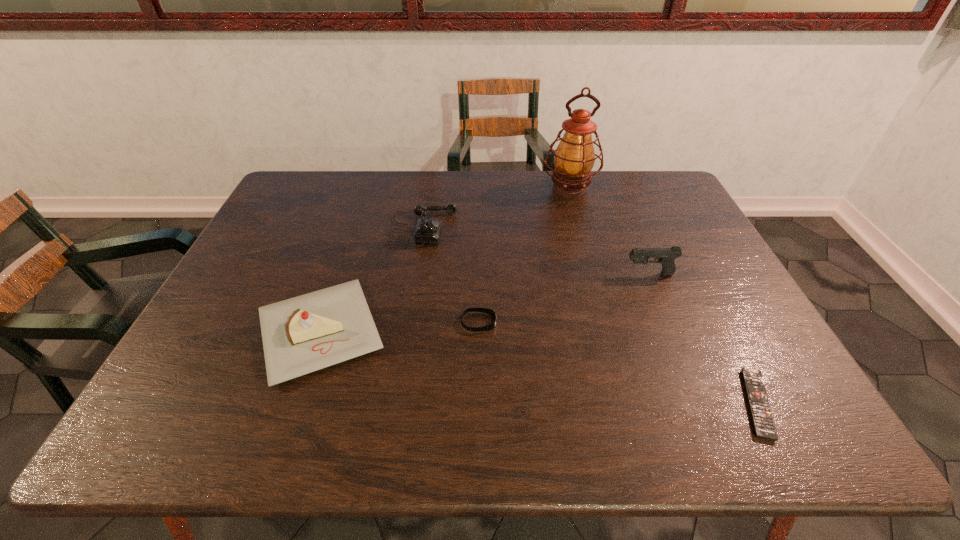
What are the coordinates of `vacant region located 0.200m on the right of the oil lamp` in the screenshot? It's located at tap(656, 188).

Find the location of a particular element. The image size is (960, 540). free spot located at the barrel of the fourth nearest object is located at coordinates (527, 274).

In order to click on vacant space situated 0.380m at the barrel of the fourth nearest object in this screenshot , I will do [487, 274].

Locate an element on the screen. This screenshot has width=960, height=540. vacant point located at the barrel of the fourth nearest object is located at coordinates (491, 274).

Image resolution: width=960 pixels, height=540 pixels. I want to click on free space located on the dial of the telephone, so click(x=511, y=228).

I want to click on free space located 0.070m on the front of the cake, so click(290, 421).

Locate an element on the screen. vacant area situated on the display of the wristband is located at coordinates (603, 322).

This screenshot has height=540, width=960. Find the location of `vacant position located on the back of the rightmost object`. vacant position located on the back of the rightmost object is located at coordinates (686, 266).

Locate an element on the screen. object that is at the far edge is located at coordinates 574,157.

This screenshot has height=540, width=960. What are the coordinates of `object at the near edge` in the screenshot? It's located at (764, 427).